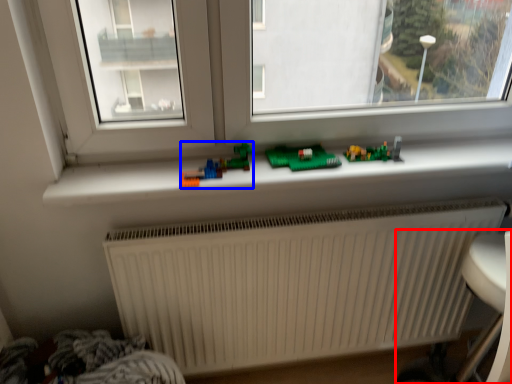
Question: Among these objects, which one is farthest to the camera, armchair (highlighted by a red box) or toy (highlighted by a blue box)?

Choices:
 (A) armchair
 (B) toy

Answer: (B)